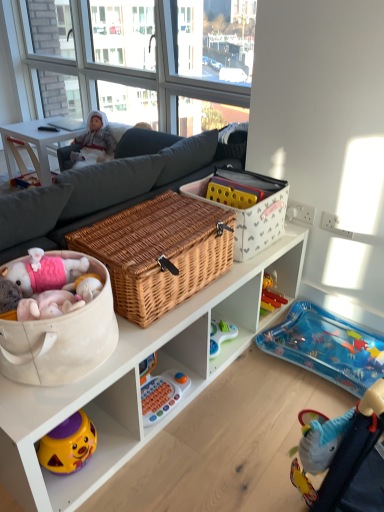
Question: From a real-world perspective, is woven wood basket at center located beneath white wicker basket at upper center, which is counted as the second storage box, starting from the front?

Choices:
 (A) no
 (B) yes

Answer: (B)

Question: Can you confirm if woven wood basket at center is wider than white wicker basket at upper center, acting as the 1th storage box starting from the right?

Choices:
 (A) yes
 (B) no

Answer: (A)

Question: Can you confirm if woven wood basket at center is taller than white wicker basket at upper center, the first storage box from the back?

Choices:
 (A) no
 (B) yes

Answer: (A)

Question: Is woven wood basket at center to the left of white wicker basket at upper center, the 2th storage box in the left-to-right sequence, from the viewer's perspective?

Choices:
 (A) yes
 (B) no

Answer: (A)

Question: Are woven wood basket at center and white wicker basket at upper center, the 2th storage box in the left-to-right sequence, beside each other?

Choices:
 (A) yes
 (B) no

Answer: (B)

Question: Is woven wood basket at center shorter than white wicker basket at upper center, the first storage box from the back?

Choices:
 (A) yes
 (B) no

Answer: (A)

Question: Does woven brown picnic basket at center lie in front of transparent glass window at upper center?

Choices:
 (A) no
 (B) yes

Answer: (B)

Question: Is woven brown picnic basket at center not close to transparent glass window at upper center?

Choices:
 (A) yes
 (B) no

Answer: (A)

Question: Is transparent glass window at upper center inside woven brown picnic basket at center?

Choices:
 (A) yes
 (B) no

Answer: (B)

Question: Does woven brown picnic basket at center turn towards transparent glass window at upper center?

Choices:
 (A) yes
 (B) no

Answer: (B)

Question: From a real-world perspective, is woven brown picnic basket at center under transparent glass window at upper center?

Choices:
 (A) no
 (B) yes

Answer: (B)

Question: Is woven brown picnic basket at center oriented away from transparent glass window at upper center?

Choices:
 (A) no
 (B) yes

Answer: (A)

Question: From the image's perspective, is white plush doll at upper left under beige fabric basket at lower left, which is the first storage box in left-to-right order?

Choices:
 (A) yes
 (B) no

Answer: (B)